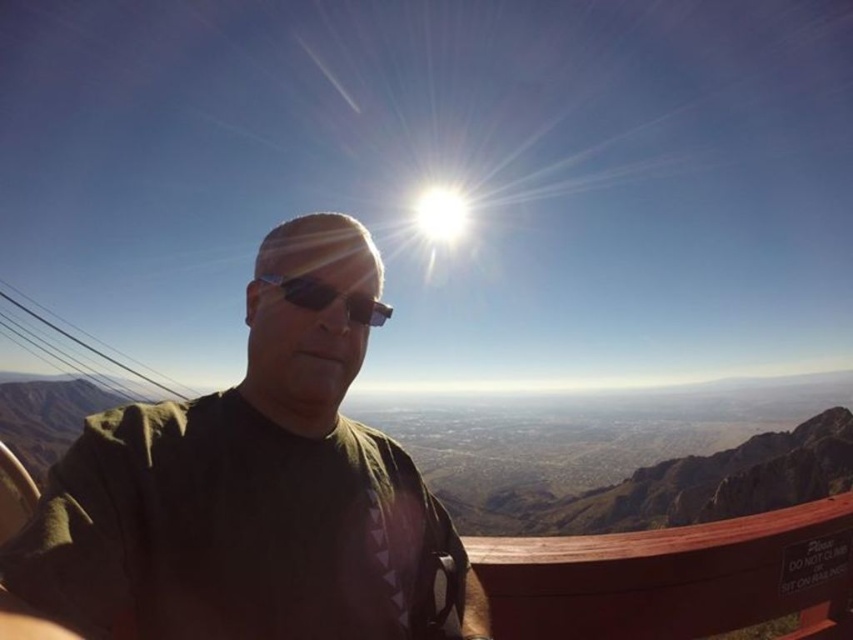
From the picture: You are a photographer trying to capture the same selfie composition as the person in the image. You want to ensure that the dark green T shirt is centered in your photo. Given that the original selfie has the point at coordinates (247, 488) marking the center of the dark green T shirt, what coordinates should you aim for to center the T shirt in your own photo?

To center the dark green T shirt in your photo, you should aim for the coordinates (247, 488) as that point marks the center of the dark green T shirt in the original image.